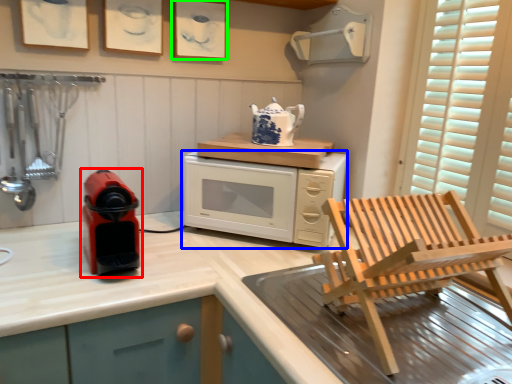
Question: Considering the real-world distances, which object is farthest from home appliance (highlighted by a red box)? microwave oven (highlighted by a blue box) or picture frame (highlighted by a green box)?

Choices:
 (A) microwave oven
 (B) picture frame

Answer: (B)